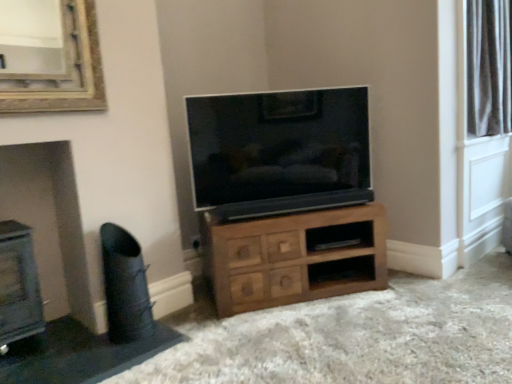
What are the coordinates of `vacant space to the right of wooden chest of drawers at center` in the screenshot? It's located at (442, 304).